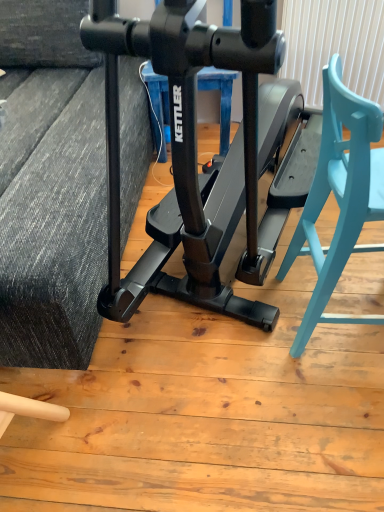
Measure the distance between point (297, 230) and camera.

Point (297, 230) is 4.74 feet away from camera.

What is the approximate width of teal wood chair at right?

teal wood chair at right is 15.53 inches wide.

Describe the element at coordinates (339, 197) in the screenshot. This screenshot has width=384, height=512. I see `teal wood chair at right` at that location.

At what (x,y) coordinates should I click in order to perform the action: click on teal wood chair at right. Please return your answer as a coordinate pair (x, y). Looking at the image, I should click on (339, 197).

At what (x,y) coordinates should I click in order to perform the action: click on teal wood chair at right. Please return your answer as a coordinate pair (x, y). Looking at the image, I should click on (339, 197).